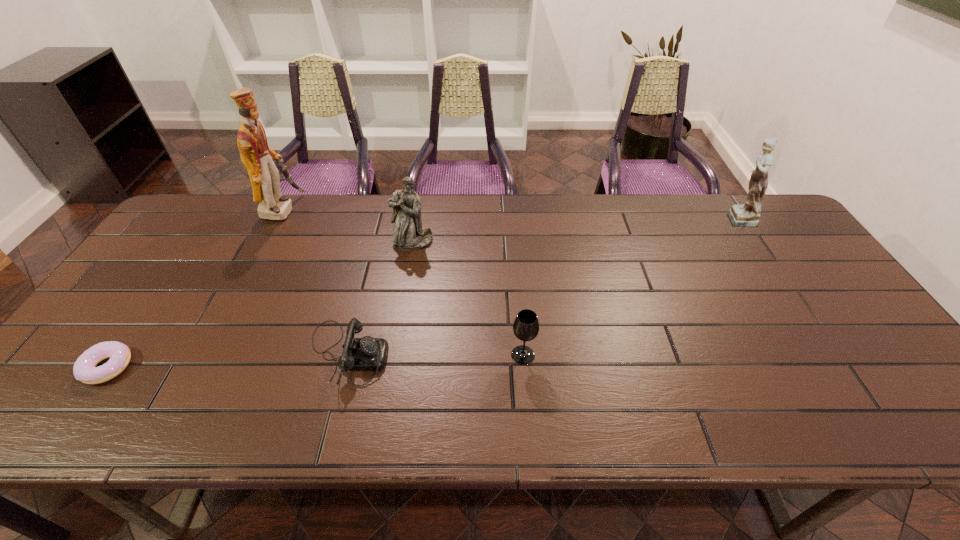
The height and width of the screenshot is (540, 960). What are the coordinates of `nutcracker` in the screenshot? It's located at (258, 158).

The width and height of the screenshot is (960, 540). Identify the location of the second object from left to right. (258, 158).

Where is `the farther figurine`? This screenshot has width=960, height=540. the farther figurine is located at coordinates [x=746, y=215].

At what (x,y) coordinates should I click in order to perform the action: click on the right figurine. Please return your answer as a coordinate pair (x, y). This screenshot has height=540, width=960. Looking at the image, I should click on pos(746,215).

This screenshot has width=960, height=540. I want to click on the shorter figurine, so click(408, 234).

Image resolution: width=960 pixels, height=540 pixels. Identify the location of the nearer figurine. (408, 234).

Locate an element on the screen. the fourth tallest object is located at coordinates (526, 326).

Where is `the fifth object from left to right`? This screenshot has height=540, width=960. the fifth object from left to right is located at coordinates (526, 326).

Identify the location of the fifth tallest object. (359, 354).

Image resolution: width=960 pixels, height=540 pixels. Identify the location of doughnut. (84, 369).